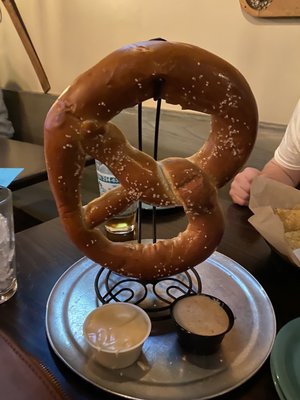
Where is `plate`? Image resolution: width=300 pixels, height=400 pixels. plate is located at coordinates (242, 297).